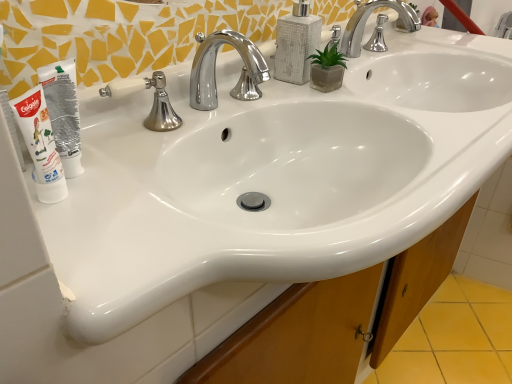
Question: Considering the positions of white tube at left and silver/chrome faucet at center in the image, is white tube at left bigger or smaller than silver/chrome faucet at center?

Choices:
 (A) big
 (B) small

Answer: (B)

Question: Choose the correct answer: Is white tube at left inside silver/chrome faucet at center or outside it?

Choices:
 (A) inside
 (B) outside

Answer: (B)

Question: Which is nearer to the chrome/metallic faucet at upper center, the first tap viewed from the right?

Choices:
 (A) polished chrome faucet at center, which is counted as the first tap, starting from the front
 (B) white tube at left
 (C) white matte tube at left
 (D) silver/chrome faucet at center
 (E) white textured soap dispenser at upper center

Answer: (E)

Question: Which of these objects is positioned farthest from the white matte tube at left?

Choices:
 (A) chrome/metallic faucet at upper center, marked as the second tap in a bottom-to-top arrangement
 (B) polished chrome faucet at center, the 2th tap when ordered from back to front
 (C) white textured soap dispenser at upper center
 (D) silver/chrome faucet at center
 (E) white tube at left

Answer: (A)